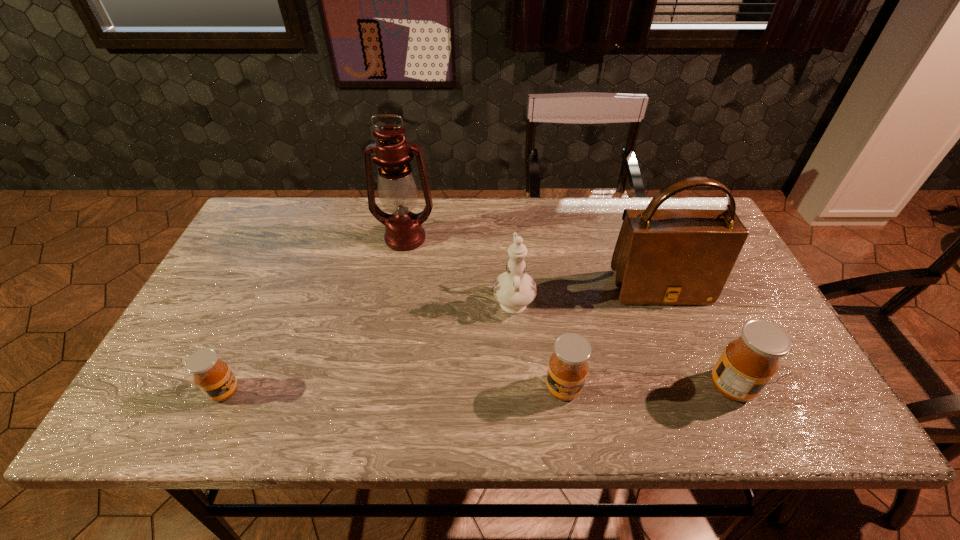
This screenshot has height=540, width=960. Find the location of `vacant space that is in between the second honey from right to left and the farthest object`. vacant space that is in between the second honey from right to left and the farthest object is located at coordinates (484, 313).

Locate an element on the screen. vacant region between the farthest object and the third shortest object is located at coordinates (568, 312).

The image size is (960, 540). I want to click on free spot between the fifth tallest object and the leftmost object, so click(394, 390).

Find the location of `vacant space in between the fifth tallest object and the leftmost object`. vacant space in between the fifth tallest object and the leftmost object is located at coordinates (394, 390).

At what (x,y) coordinates should I click in order to perform the action: click on vacant area that lies between the chinaware and the oil lamp. Please return your answer as a coordinate pair (x, y). The width and height of the screenshot is (960, 540). Looking at the image, I should click on (459, 268).

I want to click on vacant region between the shoulder bag and the oil lamp, so click(x=532, y=264).

Where is `free point between the second honey from left to right and the tallest honey`? The image size is (960, 540). free point between the second honey from left to right and the tallest honey is located at coordinates (647, 387).

Locate which object is the third closest to the rightmost honey. Please provide its 2D coordinates. Your answer should be formatted as a tuple, i.e. [(x, y)], where the tuple contains the x and y coordinates of a point satisfying the conditions above.

[(514, 290)]

Identify which object is the third closest to the leftmost object. Please provide its 2D coordinates. Your answer should be formatted as a tuple, i.e. [(x, y)], where the tuple contains the x and y coordinates of a point satisfying the conditions above.

[(568, 367)]

This screenshot has height=540, width=960. In order to click on the closest honey to the third shortest object in this screenshot , I will do `click(568, 367)`.